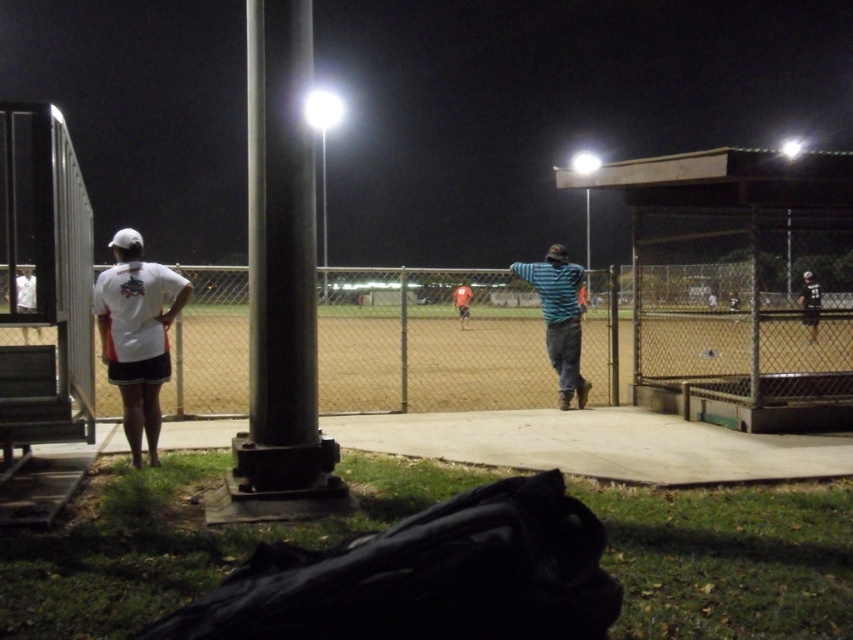
You are a photographer trying to capture a group photo of the players. The white matte shirt at left and dark blue jersey at right are the only two players visible. If you want to ensure both players are in focus, which player should you adjust the camera focus towards first?

The white matte shirt at left has a smaller width than the dark blue jersey at right. Since the photographer needs to focus on the closer subject first, adjusting focus towards the white matte shirt at left would ensure both are in focus as the wider player is further away.

You are a photographer at the baseball field. You want to take a photo of the striped cotton shirt at center without the white matte shirt at left being visible in the frame. Is this possible based on their positions?

The white matte shirt at left is positioned under the striped cotton shirt at center, so if you position your camera to focus on the striped cotton shirt at center and avoid the lower area where the white matte shirt at left is located, it should be possible to capture the striped cotton shirt at center without the white matte shirt at left being visible.

You are a photographer trying to capture a wide shot of the baseball field scene. The dark blue jersey at right and the red fabric shirt at center are both in your frame. Which clothing item appears narrower in the photo?

The dark blue jersey at right appears narrower than the red fabric shirt at center in the photo because its width is less than the red fabric shirt at center.